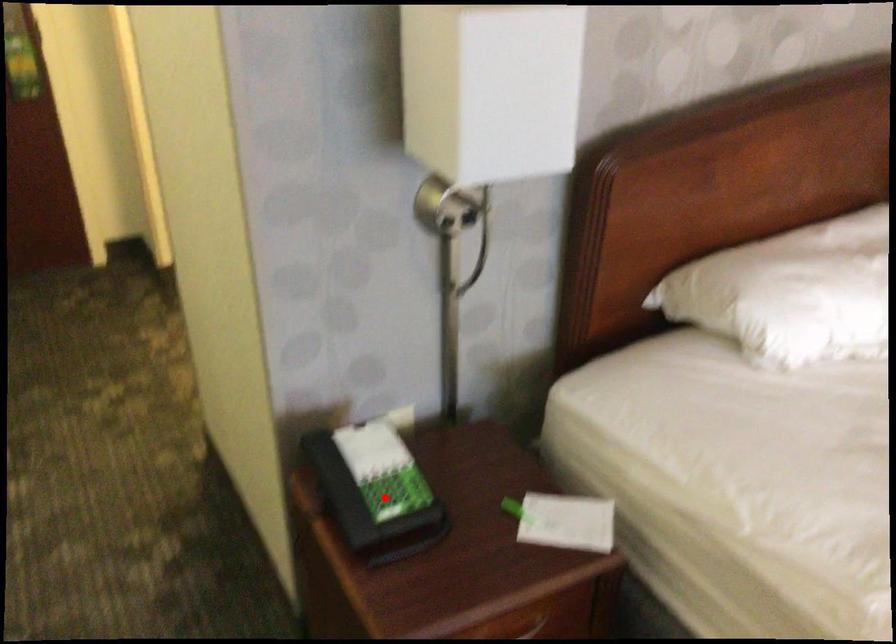
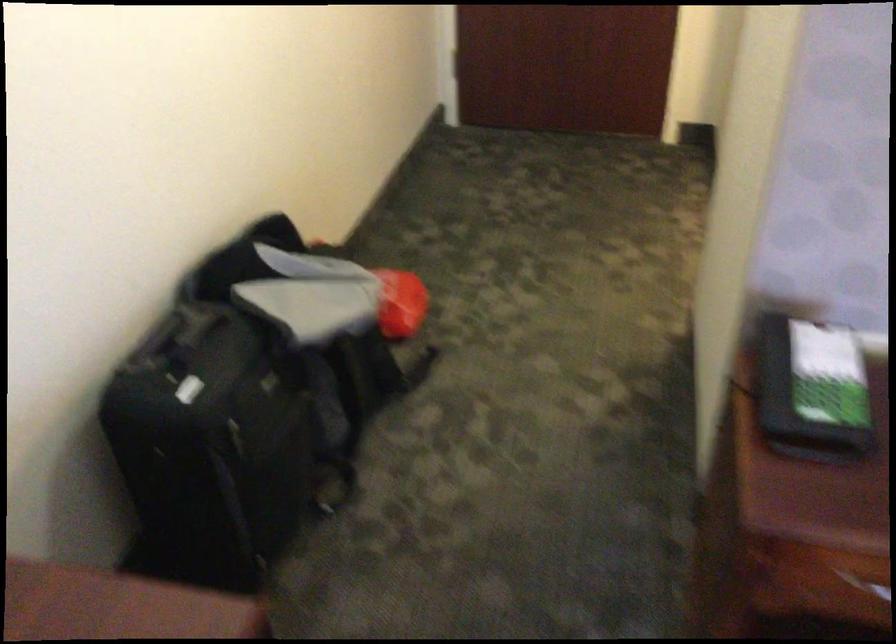
Locate, in the second image, the point that corresponds to the highlighted location in the first image.

(812, 390)